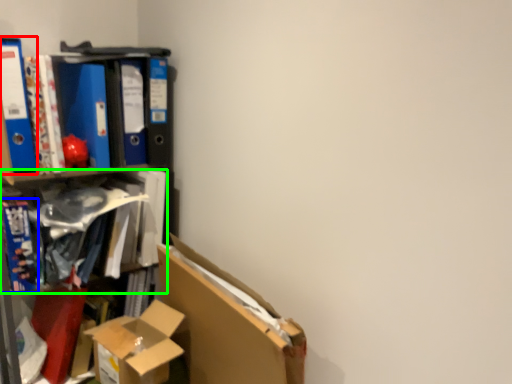
Question: Based on their relative distances, which object is farther from paperback book (highlighted by a red box)? Choose from book (highlighted by a blue box) and book (highlighted by a green box).

Choices:
 (A) book
 (B) book

Answer: (B)